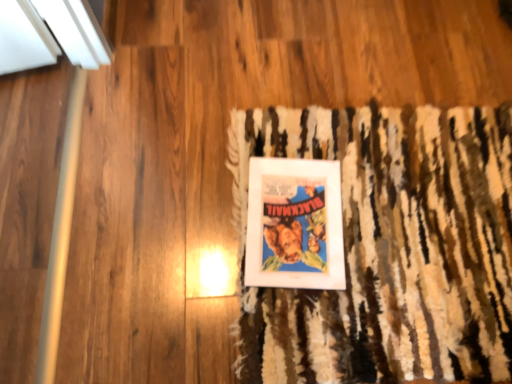
Question: Is textured brown doormat at center bigger or smaller than matte paper poster at center?

Choices:
 (A) small
 (B) big

Answer: (B)

Question: Considering their positions, is textured brown doormat at center located in front of or behind matte paper poster at center?

Choices:
 (A) behind
 (B) front

Answer: (B)

Question: Is textured brown doormat at center wider or thinner than matte paper poster at center?

Choices:
 (A) thin
 (B) wide

Answer: (B)

Question: From a real-world perspective, is matte paper poster at center physically located above or below textured brown doormat at center?

Choices:
 (A) above
 (B) below

Answer: (B)

Question: Which is correct: matte paper poster at center is inside textured brown doormat at center, or outside of it?

Choices:
 (A) outside
 (B) inside

Answer: (B)

Question: Is matte paper poster at center in front of or behind textured brown doormat at center in the image?

Choices:
 (A) front
 (B) behind

Answer: (B)

Question: Based on their positions, is matte paper poster at center located to the left or right of textured brown doormat at center?

Choices:
 (A) left
 (B) right

Answer: (A)